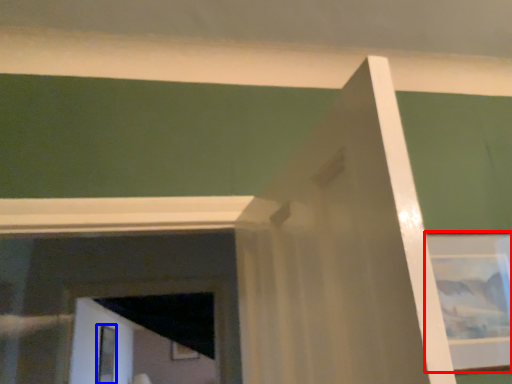
Question: Which of the following is the farthest to the observer, picture frame (highlighted by a red box) or screen door (highlighted by a blue box)?

Choices:
 (A) picture frame
 (B) screen door

Answer: (B)